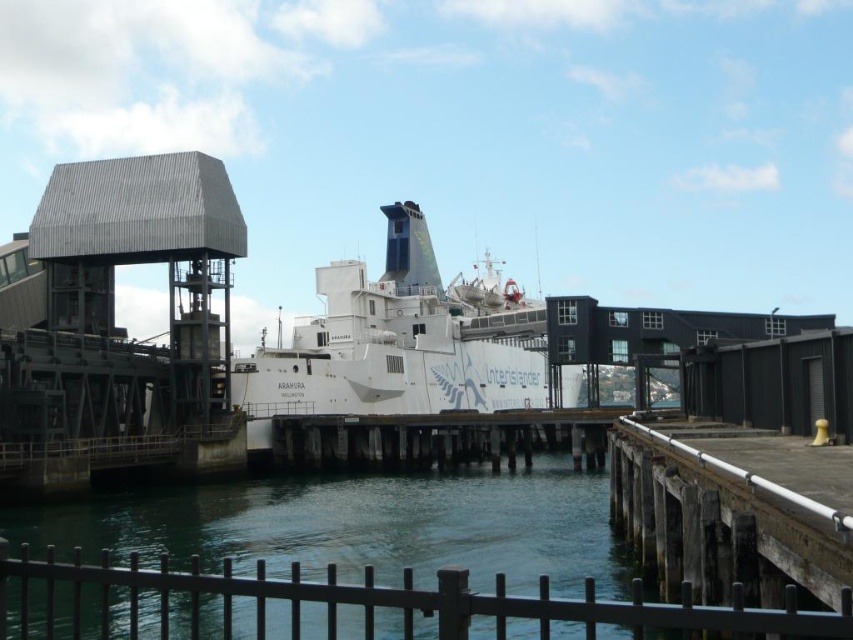
You are standing on the pier and see the greenish water at lower center and the white matte ship at center. Which object is closer to your left side?

The greenish water at lower center is positioned on the left side of the white matte ship at center, so it is closer to your left side.

You are standing on the pier and want to cross to the ferry. There is greenish water at lower center and wooden at center. Which path is wider?

The greenish water at lower center might be wider than wooden at center according to the description provided.

You are a passenger on the pier and want to board the white matte ship at center. There is a wooden at center blocking your path. Can you walk around it to reach the ship?

The wooden at center is behind the white matte ship at center, so you can walk around it to reach the ship.